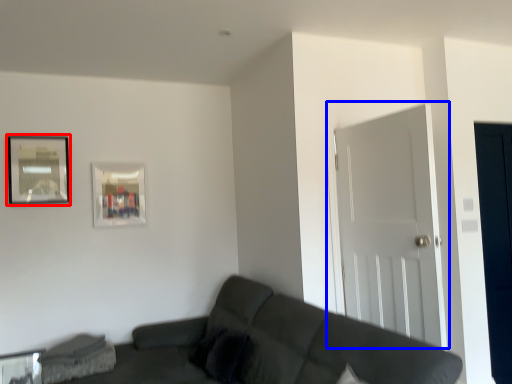
Question: Which object is closer to the camera taking this photo, picture frame (highlighted by a red box) or door (highlighted by a blue box)?

Choices:
 (A) picture frame
 (B) door

Answer: (B)